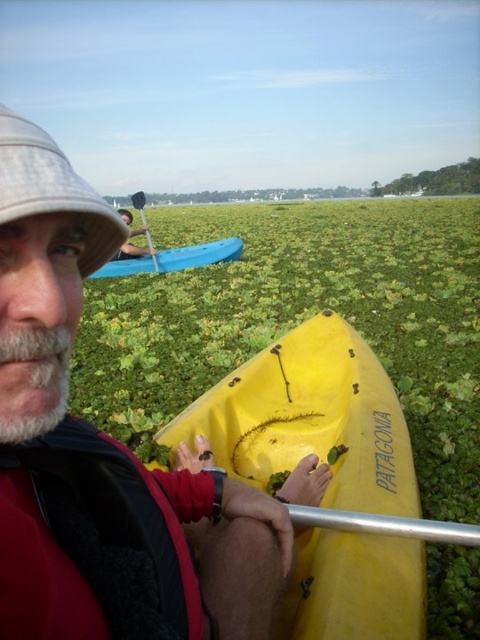
Based on the photo, you are planning to rent a kayak for a day trip. You see both the matte yellow kayak at center and the blue plastic kayak at upper left in the image. Which one would you choose if you want a larger kayak for more space?

The matte yellow kayak at center is larger in size than the blue plastic kayak at upper left, so you should choose the matte yellow kayak at center for more space.

You are a photographer standing on the shore of the waterway. You want to take a photo of both the yellow matte kayak at lower center and the blue kayak in the image. The minimum distance between the two kayaks required for your camera lens to capture both in focus is 3 feet. Can you capture both kayaks clearly in a single photo?

The two kayaks are 3.37 feet apart, which is more than the 3 feet minimum distance required for the camera lens to capture both in focus. Therefore, you can capture both the yellow matte kayak at lower center and the blue kayak clearly in a single photo.

You are planning to take a photo of the kayakers from the shore. You notice the white fabric hat at upper left and the blue plastic kayak at upper left in your camera viewfinder. Which object should you focus on if you want to capture the larger subject in your photo?

You should focus on the blue plastic kayak at upper left because the white fabric hat at upper left occupies less space than the blue plastic kayak at upper left, making the kayak the larger subject.